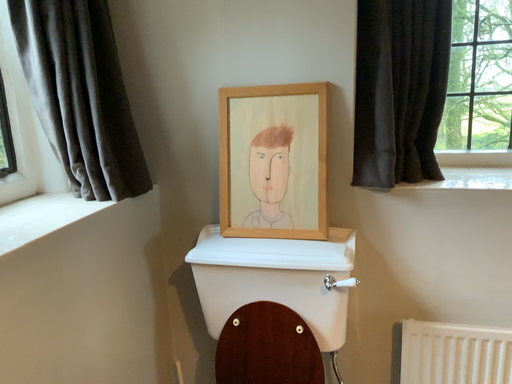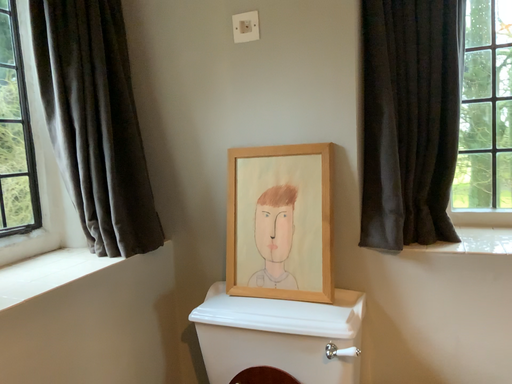
Question: Which way did the camera rotate in the video?

Choices:
 (A) rotated right
 (B) rotated left

Answer: (B)